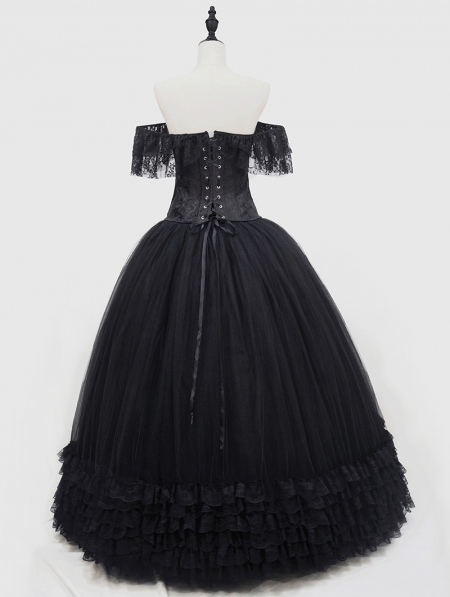
You are a GUI agent. You are given a task and a screenshot of the screen. Output one action in this format:
    pyautogui.click(x=<x>, y=<y>)
    Task: Click on the dropcloth
    The image size is (450, 597).
    Given the screenshot: What is the action you would take?
    pyautogui.click(x=89, y=583)